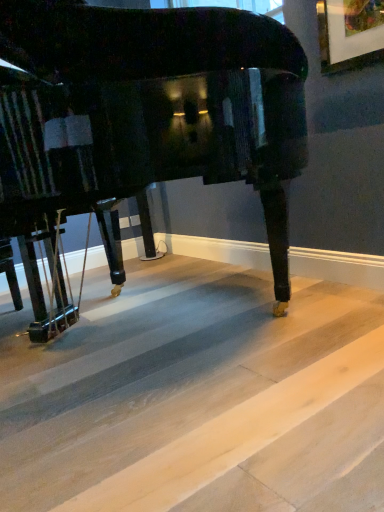
Question: From a real-world perspective, is glossy black piano at center positioned above or below light wood flooring at lower center?

Choices:
 (A) above
 (B) below

Answer: (A)

Question: Is glossy black piano at center in front of or behind light wood flooring at lower center in the image?

Choices:
 (A) behind
 (B) front

Answer: (A)

Question: Is glossy black piano at center inside the boundaries of light wood flooring at lower center, or outside?

Choices:
 (A) inside
 (B) outside

Answer: (B)

Question: From a real-world perspective, is light wood flooring at lower center above or below glossy black piano at center?

Choices:
 (A) below
 (B) above

Answer: (A)

Question: Does point coord(11,328) appear closer or farther from the camera than point coord(162,18)?

Choices:
 (A) closer
 (B) farther

Answer: (B)

Question: Considering the positions of light wood flooring at lower center and glossy black piano at center in the image, is light wood flooring at lower center taller or shorter than glossy black piano at center?

Choices:
 (A) tall
 (B) short

Answer: (B)

Question: Would you say light wood flooring at lower center is inside or outside glossy black piano at center?

Choices:
 (A) inside
 (B) outside

Answer: (B)